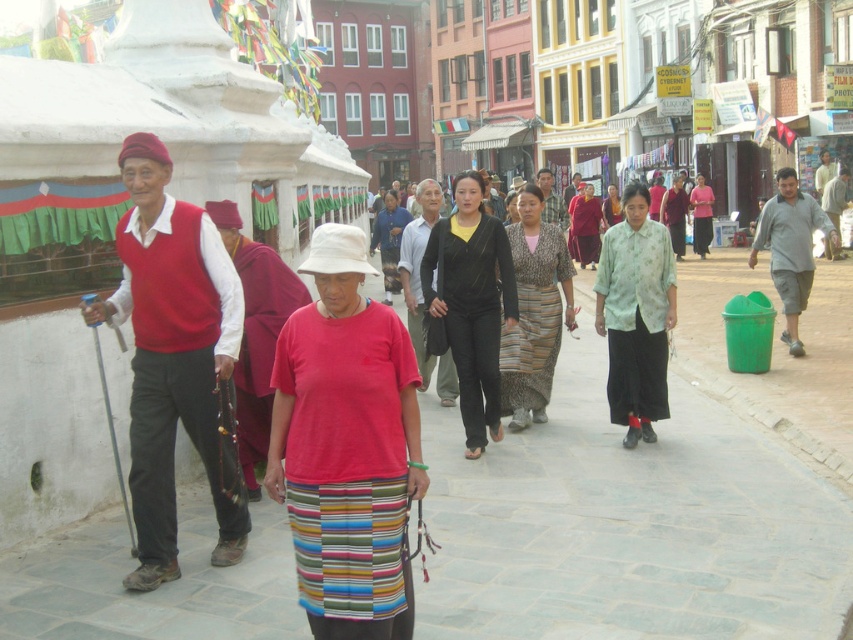
You are a pedestrian standing on the gray stone pavement at center. You want to walk towards the matte red vest at left. Is the path clear?

The gray stone pavement at center is in front of matte red vest at left, so the path is clear for you to walk towards the matte red vest at left.

You are a photographer standing at the lower right corner of the image. You want to take a photo of the matte red vest at left and the light brown leather shoes at lower right. Which object is closer to your current position?

The light brown leather shoes at lower right are closer to your current position since they are located at the lower right corner where you are standing, while the matte red vest at left is positioned below them, indicating it is further away.